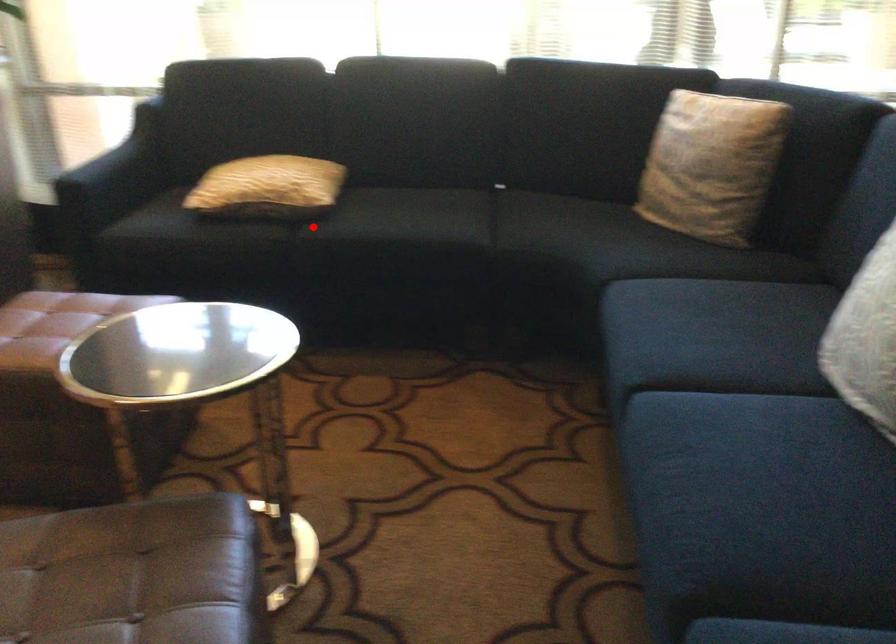
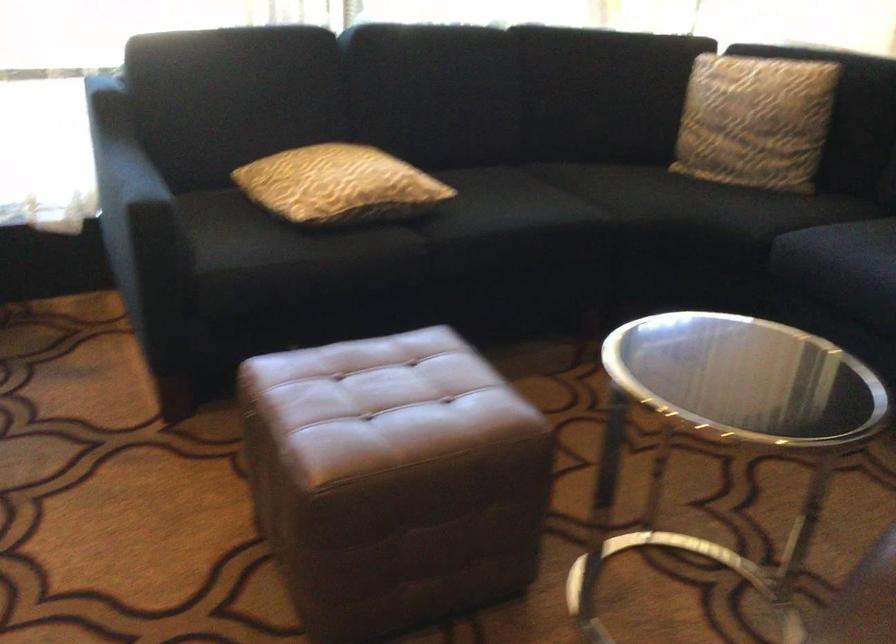
The point at the highlighted location is marked in the first image. Where is the corresponding point in the second image?

(426, 227)